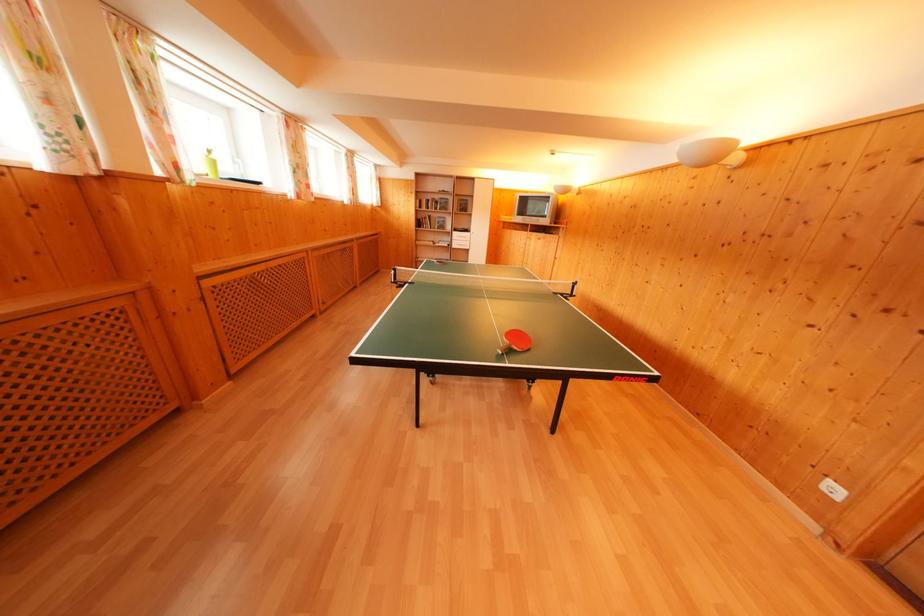
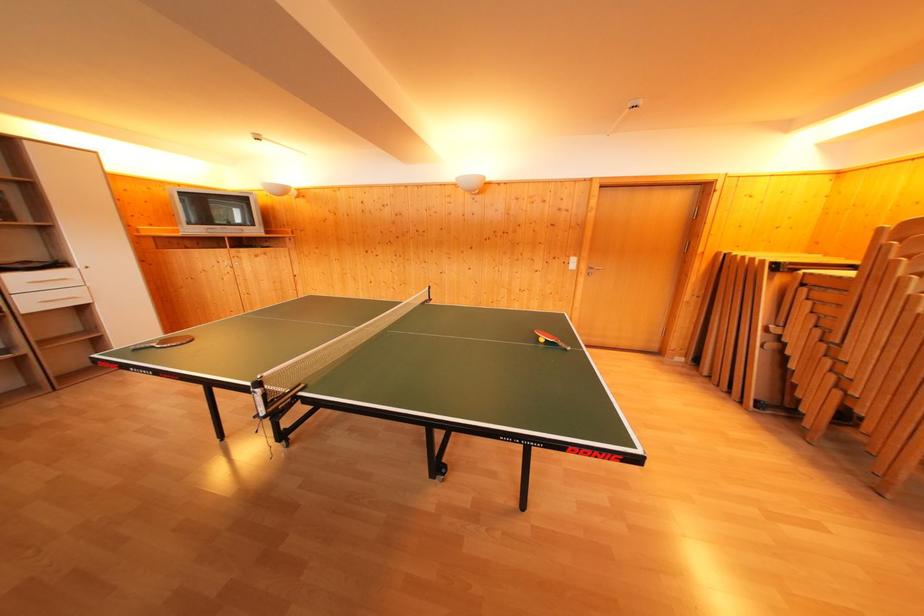
Find the pixel in the second image that matches (x=472, y=236) in the first image.

(64, 270)